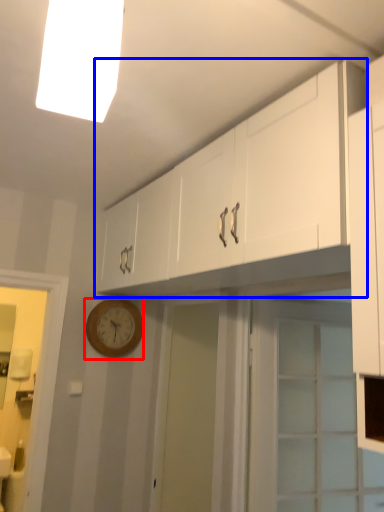
Question: Which object appears farthest to the camera in this image, wall clock (highlighted by a red box) or cabinetry (highlighted by a blue box)?

Choices:
 (A) wall clock
 (B) cabinetry

Answer: (A)